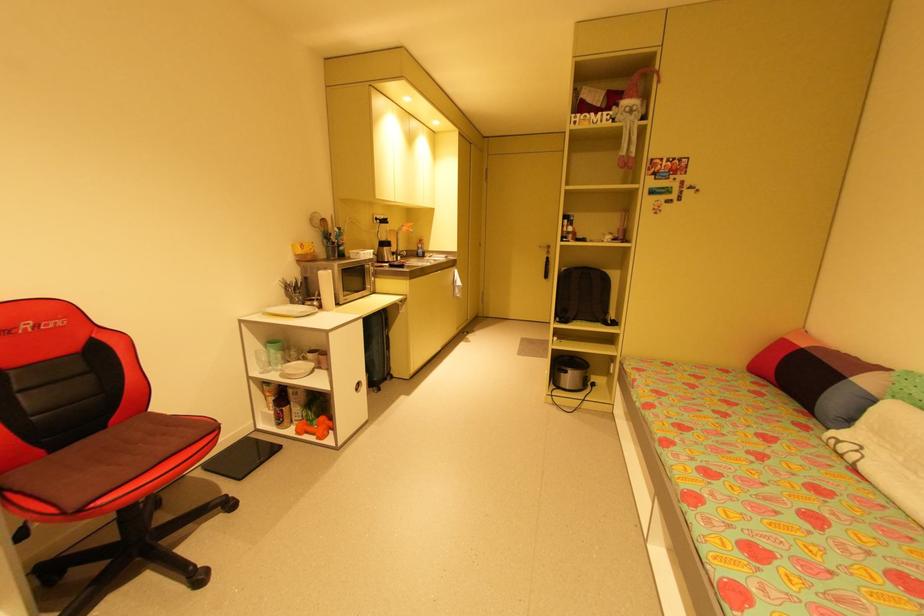
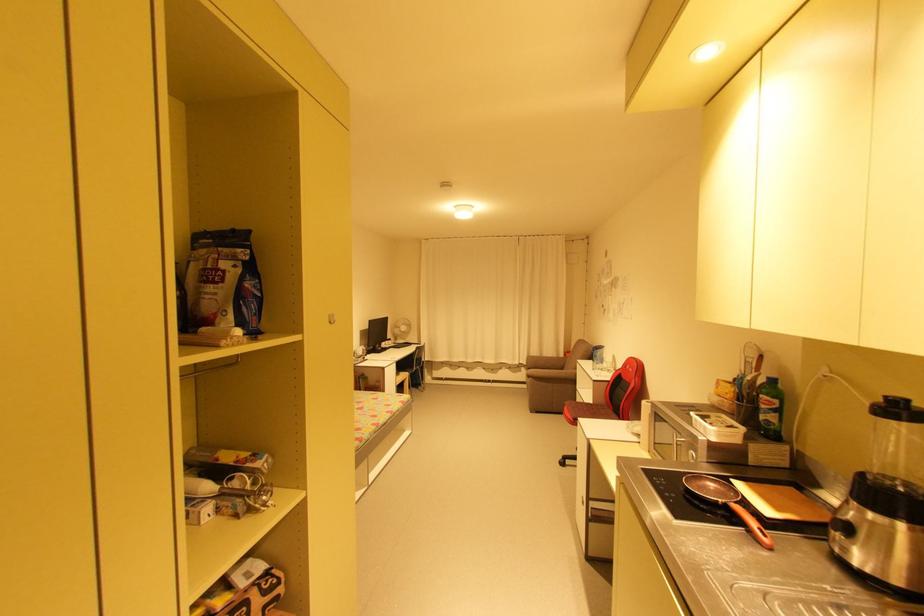
Where in the second image is the point corresponding to [30,326] from the first image?

(631, 367)